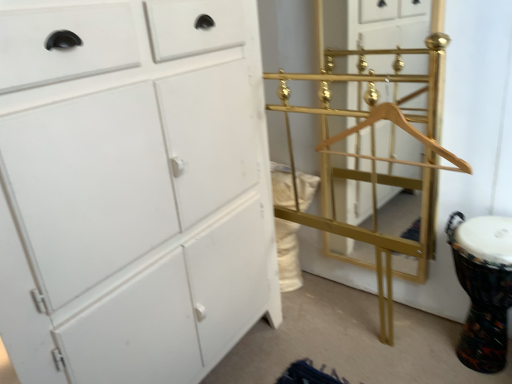
Identify the location of vacant region to the left of multicolored fabric drum at lower right. This screenshot has height=384, width=512. (400, 343).